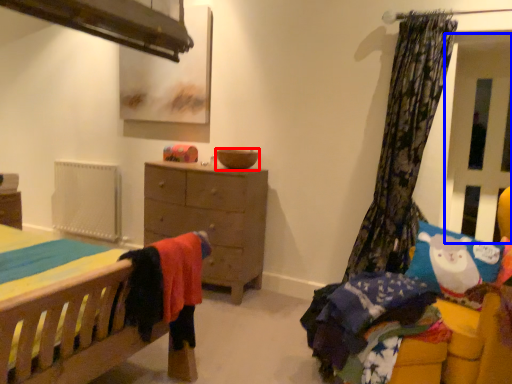
Question: Which object is closer to the camera taking this photo, bowl (highlighted by a red box) or screen door (highlighted by a blue box)?

Choices:
 (A) bowl
 (B) screen door

Answer: (B)